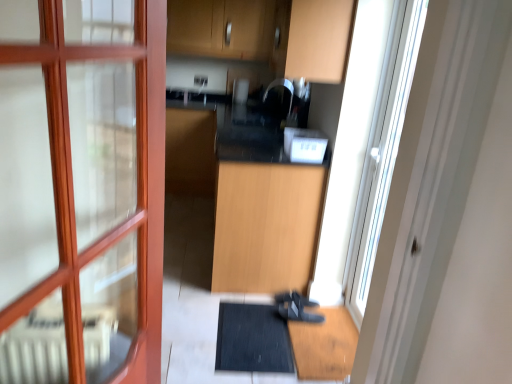
Locate an element on the screen. This screenshot has width=512, height=384. unoccupied region to the right of black matte shoe at lower center is located at coordinates pos(332,312).